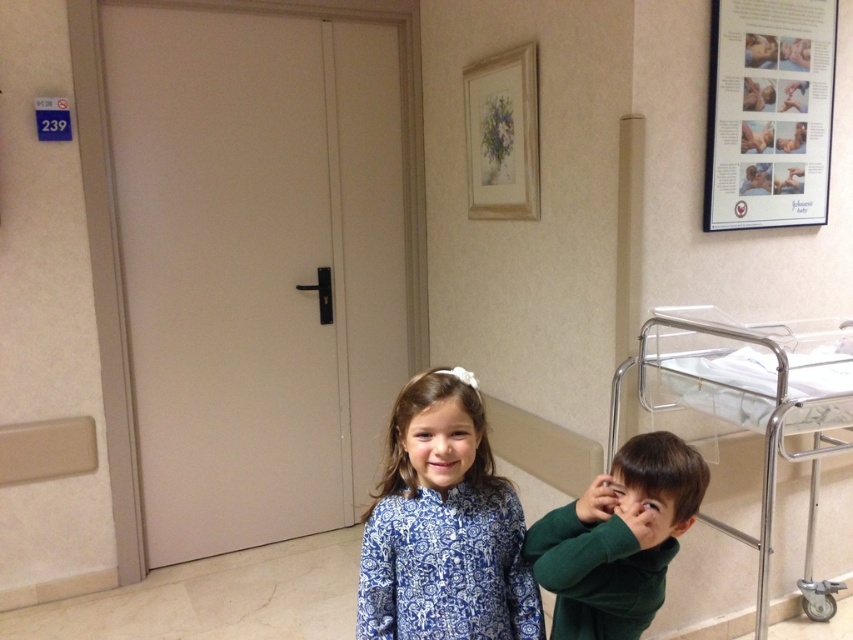
Question: Can you confirm if blue printed dress at center is wider than green matte shirt at lower right?

Choices:
 (A) yes
 (B) no

Answer: (A)

Question: Can you confirm if blue printed dress at center is positioned to the right of metallic hospital bed at right?

Choices:
 (A) no
 (B) yes

Answer: (A)

Question: Does metallic hospital bed at right have a larger size compared to green matte shirt at lower right?

Choices:
 (A) no
 (B) yes

Answer: (B)

Question: Which object is the farthest from the green matte shirt at lower right?

Choices:
 (A) blue printed dress at center
 (B) metallic hospital bed at right

Answer: (B)

Question: Which point is closer to the camera taking this photo?

Choices:
 (A) (643, 563)
 (B) (496, 609)
 (C) (816, 486)

Answer: (A)

Question: Which object appears farthest from the camera in this image?

Choices:
 (A) metallic hospital bed at right
 (B) green matte shirt at lower right
 (C) blue printed dress at center

Answer: (A)